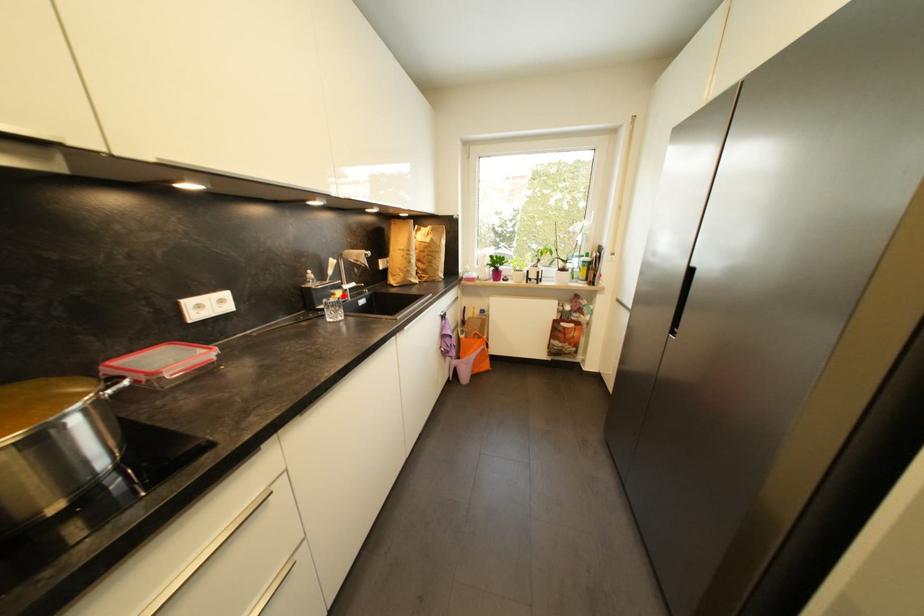
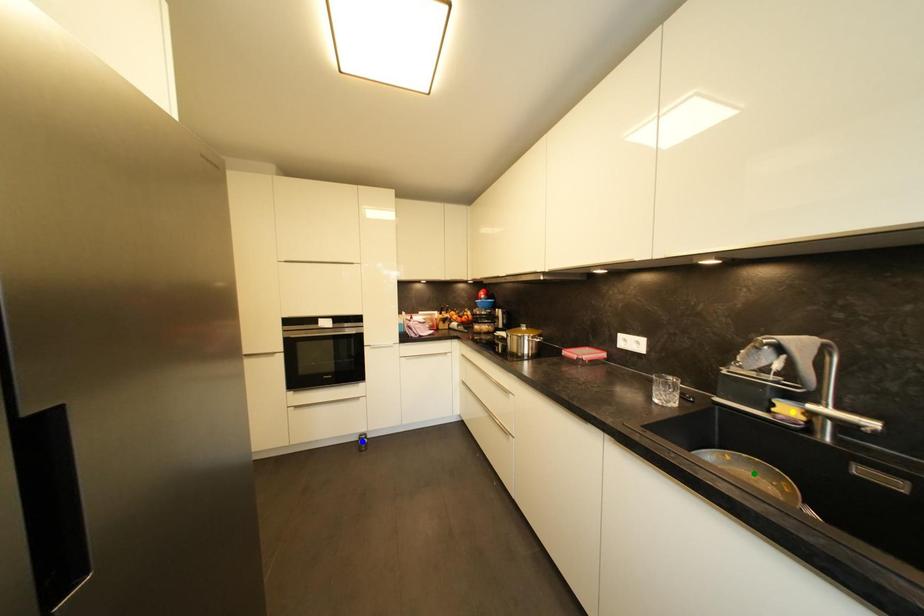
Question: I am providing you with two images of the same scene from different viewpoints. A red point is marked on the first image. You are given multiple points on the second image. Which point in image 2 is actually the same real-world point as the red point in image 1?

Choices:
 (A) yellow point
 (B) blue point
 (C) green point

Answer: (A)